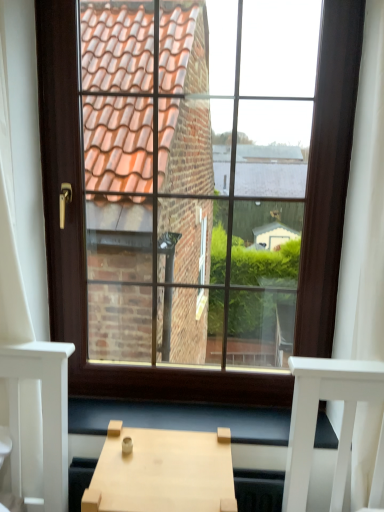
Question: Is light wood table at center in front of or behind brown wooden window at center in the image?

Choices:
 (A) front
 (B) behind

Answer: (A)

Question: Would you say light wood table at center is to the left or to the right of brown wooden window at center in the picture?

Choices:
 (A) left
 (B) right

Answer: (A)

Question: Which object is positioned closest to the brown wooden window at center?

Choices:
 (A) light wood table at center
 (B) wooden at lower center

Answer: (B)

Question: Based on their relative distances, which object is nearer to the wooden at lower center?

Choices:
 (A) light wood table at center
 (B) brown wooden window at center

Answer: (B)